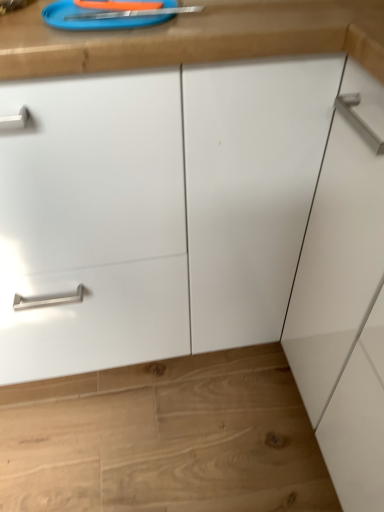
I want to click on blue plastic sink at upper center, so click(109, 16).

The image size is (384, 512). What do you see at coordinates (109, 16) in the screenshot? I see `blue plastic sink at upper center` at bounding box center [109, 16].

What are the coordinates of `blue plastic sink at upper center` in the screenshot? It's located at (109, 16).